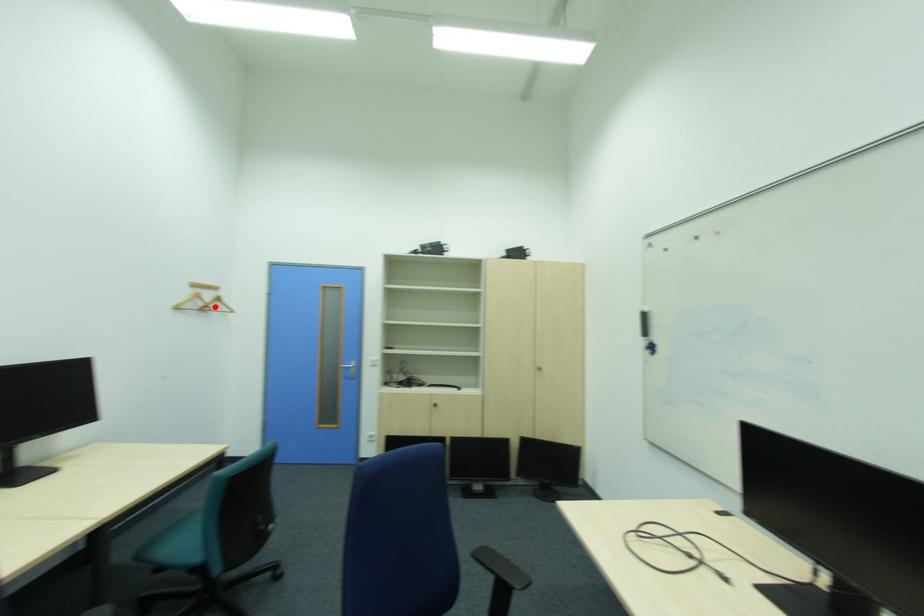
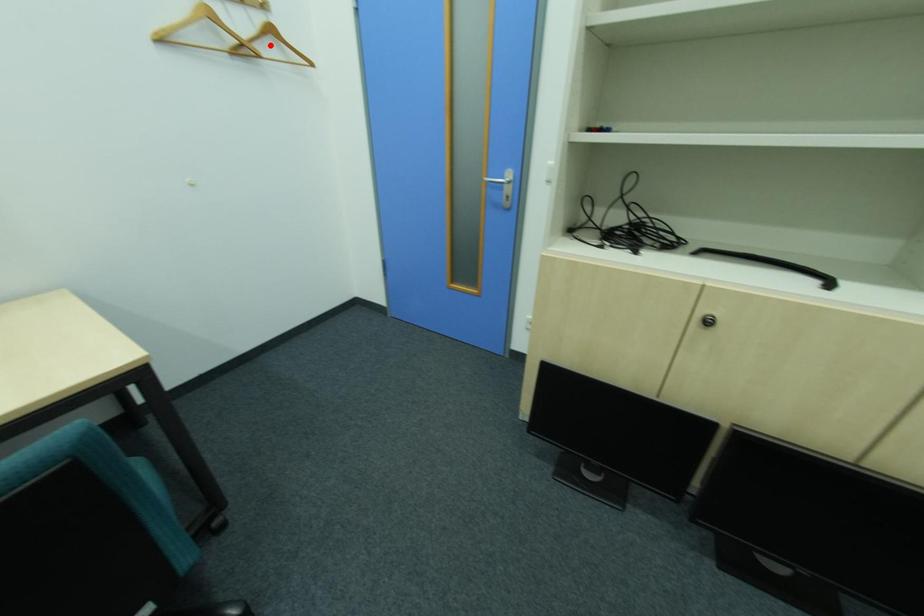
I am providing you with two images of the same scene from different viewpoints. A red point is marked on the first image and another point is marked on the second image. Does the point marked in image1 correspond to the same location as the one in image2?

No